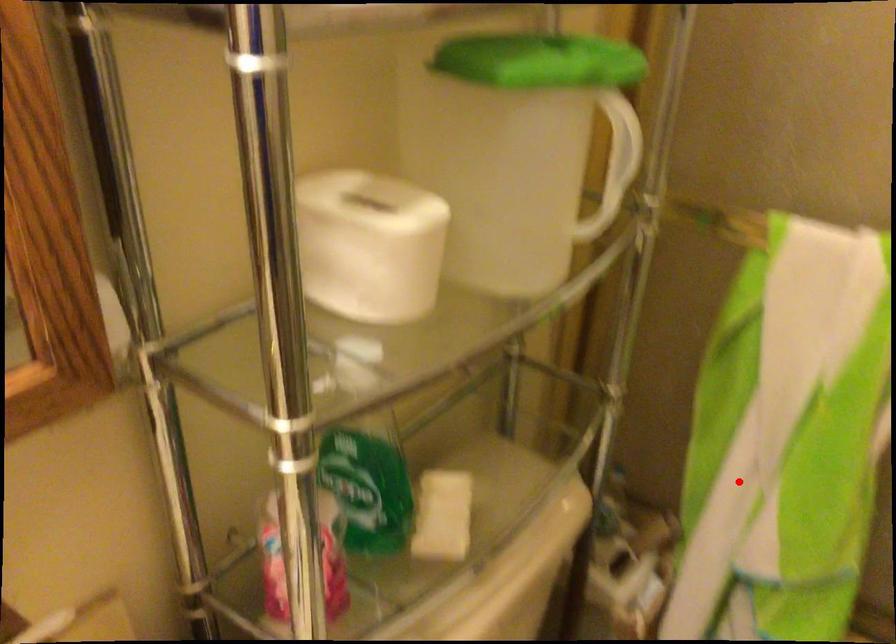
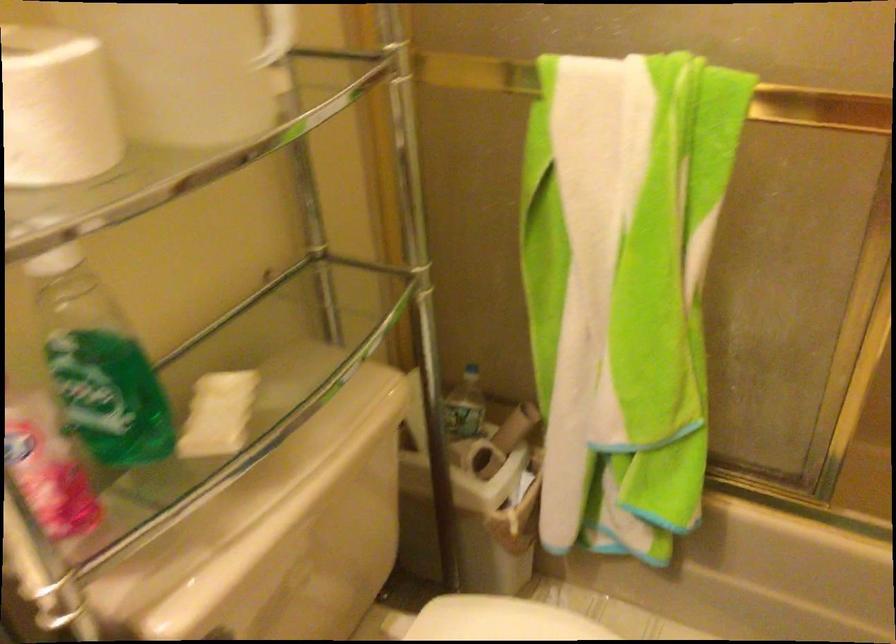
The point at the highlighted location is marked in the first image. Where is the corresponding point in the second image?

(575, 353)